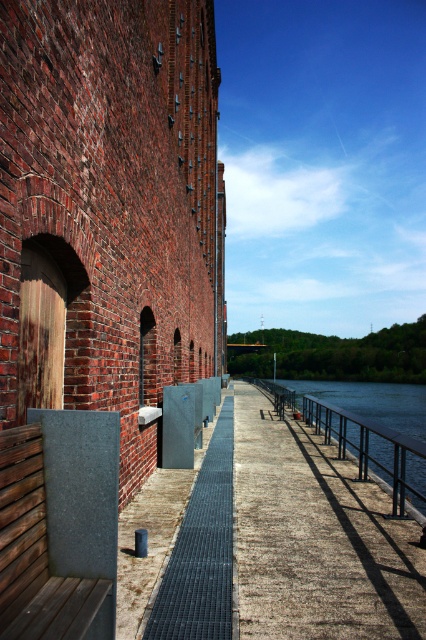
Can you confirm if metallic grating at center is wider than dark gray metal grate at center?

Yes, metallic grating at center is wider than dark gray metal grate at center.

Is point (203, 580) more distant than point (180, 627)?

That is True.

Locate an element on the screen. Image resolution: width=426 pixels, height=640 pixels. metallic grating at center is located at coordinates (285, 541).

Between point (313, 556) and point (78, 628), which one is positioned in front?

Point (78, 628) is in front.

Does metallic grating at center come in front of dark gray textured bench at lower left?

No, metallic grating at center is behind dark gray textured bench at lower left.

Image resolution: width=426 pixels, height=640 pixels. What do you see at coordinates (285, 541) in the screenshot? I see `metallic grating at center` at bounding box center [285, 541].

Identify the location of metallic grating at center. (285, 541).

Is dark gray textured bench at lower left positioned at the back of dark gray metal grate at center?

No, it is not.

Looking at this image, who is more distant from viewer, (54,410) or (189,513)?

The point (189,513) is more distant.

Is point (25, 484) positioned before point (192, 637)?

Yes, point (25, 484) is closer to viewer.

Image resolution: width=426 pixels, height=640 pixels. What are the coordinates of `dark gray textured bench at lower left` in the screenshot? It's located at (55, 531).